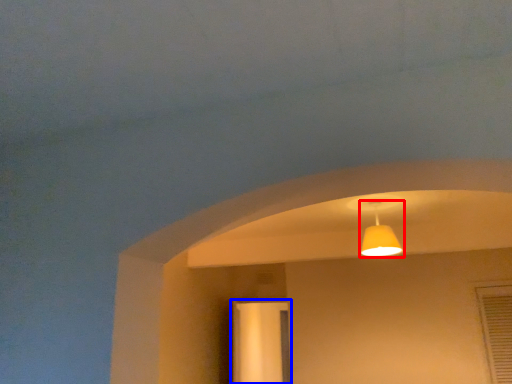
Question: Which point is further to the camera, lamp (highlighted by a red box) or screen door (highlighted by a blue box)?

Choices:
 (A) lamp
 (B) screen door

Answer: (B)